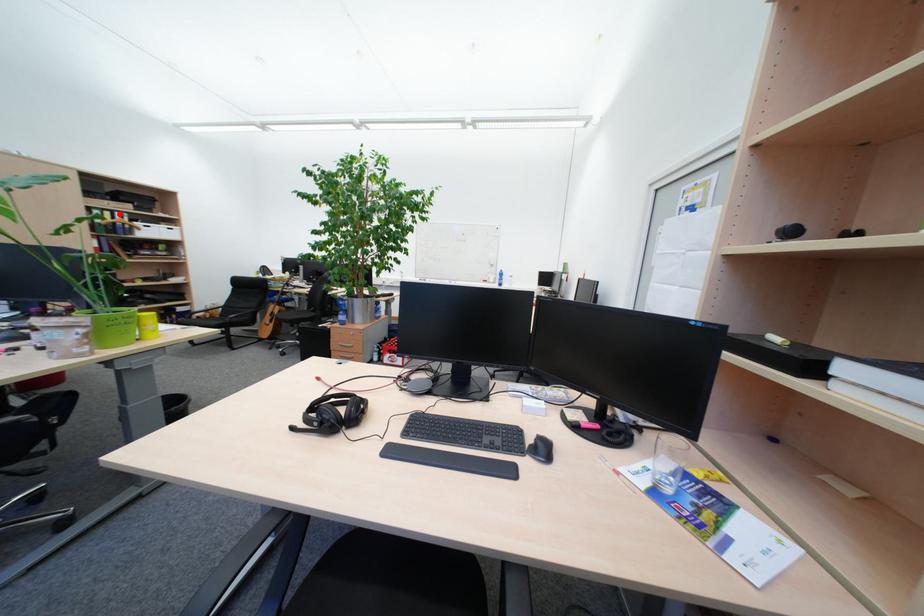
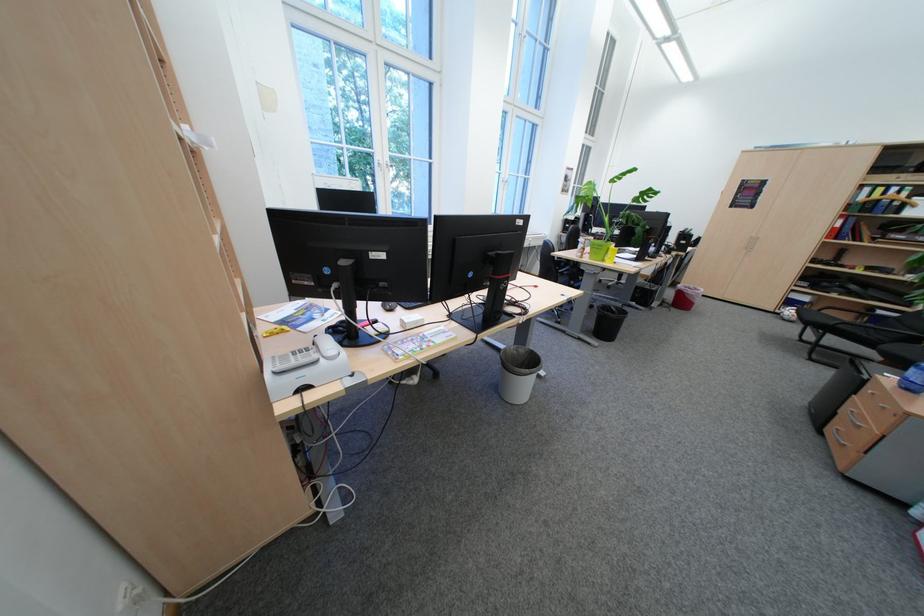
In the second image, find the point that corresponds to the highlighted location in the first image.

(893, 190)